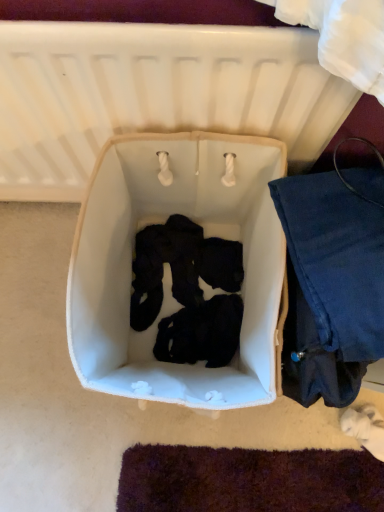
Question: Considering the positions of white fabric laundry basket at center and white fabric infant bed at center in the image, is white fabric laundry basket at center bigger or smaller than white fabric infant bed at center?

Choices:
 (A) small
 (B) big

Answer: (B)

Question: Is white fabric laundry basket at center taller or shorter than white fabric infant bed at center?

Choices:
 (A) tall
 (B) short

Answer: (B)

Question: Estimate the real-world distances between objects in this image. Which object is farther from the denim fabric pants at right?

Choices:
 (A) white fabric infant bed at center
 (B) white fabric laundry basket at center

Answer: (A)

Question: Estimate the real-world distances between objects in this image. Which object is farther from the white fabric laundry basket at center?

Choices:
 (A) denim fabric pants at right
 (B) white fabric infant bed at center

Answer: (B)